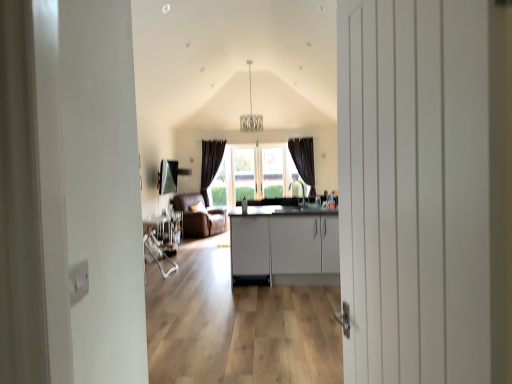
Question: Does metallic silver table at center have a greater height compared to white matte cabinet at center?

Choices:
 (A) no
 (B) yes

Answer: (A)

Question: Is white matte cabinet at center located within metallic silver table at center?

Choices:
 (A) yes
 (B) no

Answer: (B)

Question: Is metallic silver table at center not within white matte cabinet at center?

Choices:
 (A) no
 (B) yes

Answer: (B)

Question: Can you confirm if metallic silver table at center is thinner than white matte cabinet at center?

Choices:
 (A) no
 (B) yes

Answer: (B)

Question: From the image's perspective, is metallic silver table at center under white matte cabinet at center?

Choices:
 (A) no
 (B) yes

Answer: (B)

Question: Considering the positions of brown leather armchair at center and white matte cabinet at center in the image, is brown leather armchair at center taller or shorter than white matte cabinet at center?

Choices:
 (A) tall
 (B) short

Answer: (A)

Question: Is brown leather armchair at center bigger or smaller than white matte cabinet at center?

Choices:
 (A) small
 (B) big

Answer: (A)

Question: Would you say brown leather armchair at center is inside or outside white matte cabinet at center?

Choices:
 (A) outside
 (B) inside

Answer: (A)

Question: Relative to white matte cabinet at center, is brown leather armchair at center in front or behind?

Choices:
 (A) behind
 (B) front

Answer: (A)

Question: Is metallic silver table at center to the left or to the right of white matte cabinet at center in the image?

Choices:
 (A) left
 (B) right

Answer: (A)

Question: Is metallic silver table at center taller or shorter than white matte cabinet at center?

Choices:
 (A) short
 (B) tall

Answer: (A)

Question: From the image's perspective, relative to white matte cabinet at center, is metallic silver table at center above or below?

Choices:
 (A) below
 (B) above

Answer: (A)

Question: Is metallic silver table at center in front of or behind white matte cabinet at center in the image?

Choices:
 (A) front
 (B) behind

Answer: (B)

Question: From the image's perspective, is metallic silver table at center above or below white wooden door at center?

Choices:
 (A) below
 (B) above

Answer: (A)

Question: Based on their positions, is metallic silver table at center located to the left or right of white wooden door at center?

Choices:
 (A) left
 (B) right

Answer: (A)